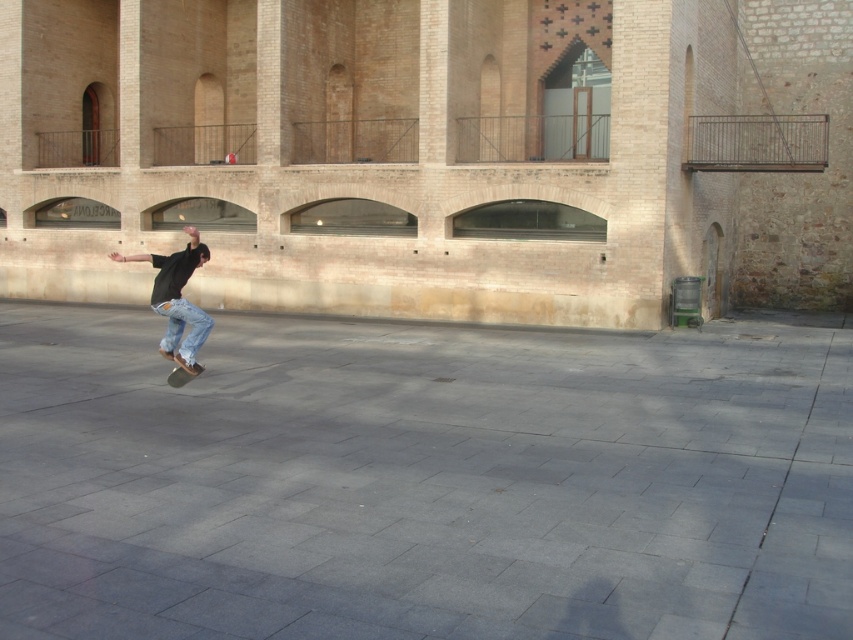
You are a photographer aiming to capture the skateboarder midair. You need to position your camera so that both the gray concrete pavement at center and the black smooth skateboard at center are visible in the frame. Which object should you focus on to ensure the skateboarder is clearly captured?

You should focus on the black smooth skateboard at center because the gray concrete pavement at center is below it, making the skateboard the central point where the skateboarder is performing the trick.

You are standing on the gray concrete pavement at center and want to move to the denim jeans at center. Which direction should you walk to reach them?

You should walk to the left because the gray concrete pavement at center is to the right of denim jeans at center, so moving left will bring you towards the denim jeans at center.